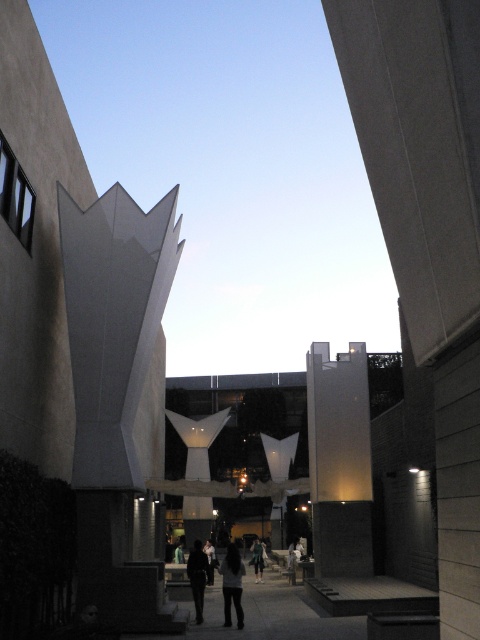
Between point (195, 593) and point (211, 580), which one is positioned in front?

Positioned in front is point (195, 593).

This screenshot has height=640, width=480. I want to click on dark clothing at center, so click(x=197, y=577).

Can you confirm if dark gray pants at center is wider than dark gray fabric jacket at center?

No, dark gray pants at center is not wider than dark gray fabric jacket at center.

What do you see at coordinates (231, 584) in the screenshot? I see `dark gray pants at center` at bounding box center [231, 584].

Locate an element on the screen. The image size is (480, 640). dark gray pants at center is located at coordinates coord(231,584).

Can you confirm if white matte sculpture at left is smaller than dark gray pants at center?

Actually, white matte sculpture at left might be larger than dark gray pants at center.

Image resolution: width=480 pixels, height=640 pixels. I want to click on white matte sculpture at left, so click(115, 388).